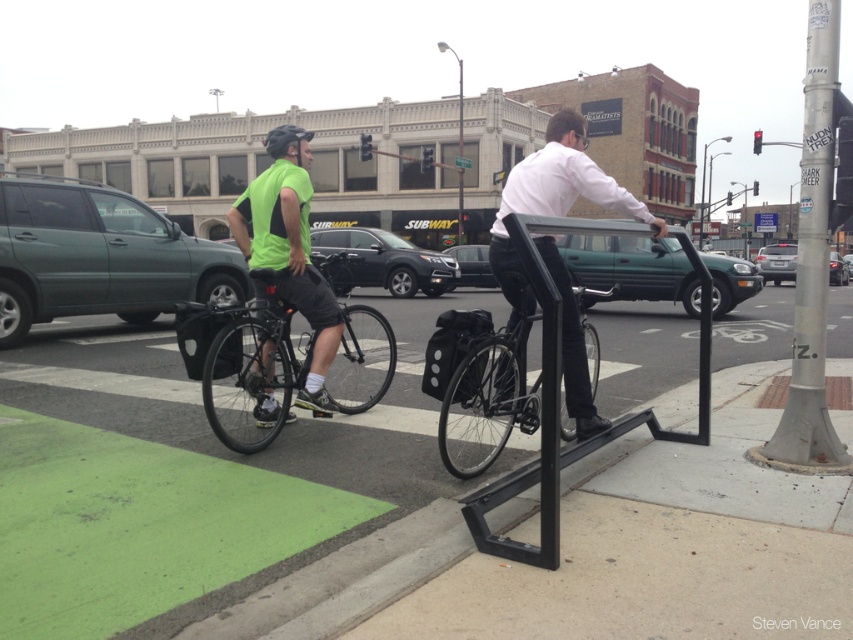
Question: Which of the following is the closest to the observer?

Choices:
 (A) teal matte car at center
 (B) silver metallic pole at right
 (C) shiny black bicycle at center

Answer: (A)

Question: Does silver metallic pole at right appear on the right side of neon green fabric shirt at center?

Choices:
 (A) yes
 (B) no

Answer: (A)

Question: Which object is farther from the camera taking this photo?

Choices:
 (A) neon green fabric shirt at center
 (B) metallic gray sedan at center

Answer: (B)

Question: Does silver metallic pole at right have a lesser width compared to metallic gray sedan at center?

Choices:
 (A) yes
 (B) no

Answer: (B)

Question: Can you confirm if green matte suv at left is wider than teal matte car at center?

Choices:
 (A) no
 (B) yes

Answer: (A)

Question: Which of the following is the farthest from the observer?

Choices:
 (A) (587, 275)
 (B) (286, 195)
 (C) (508, 300)
 (D) (392, 253)

Answer: (D)